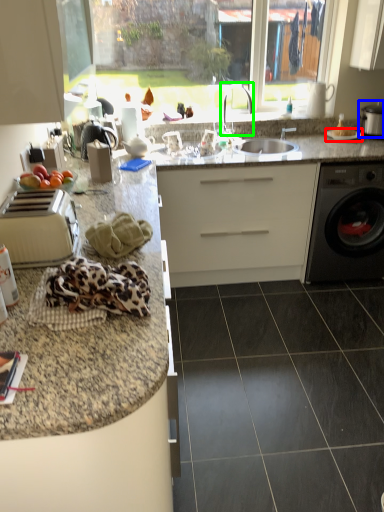
Question: Which is farther away from gas stove (highlighted by a red box)? appliance (highlighted by a blue box) or faucet (highlighted by a green box)?

Choices:
 (A) appliance
 (B) faucet

Answer: (B)